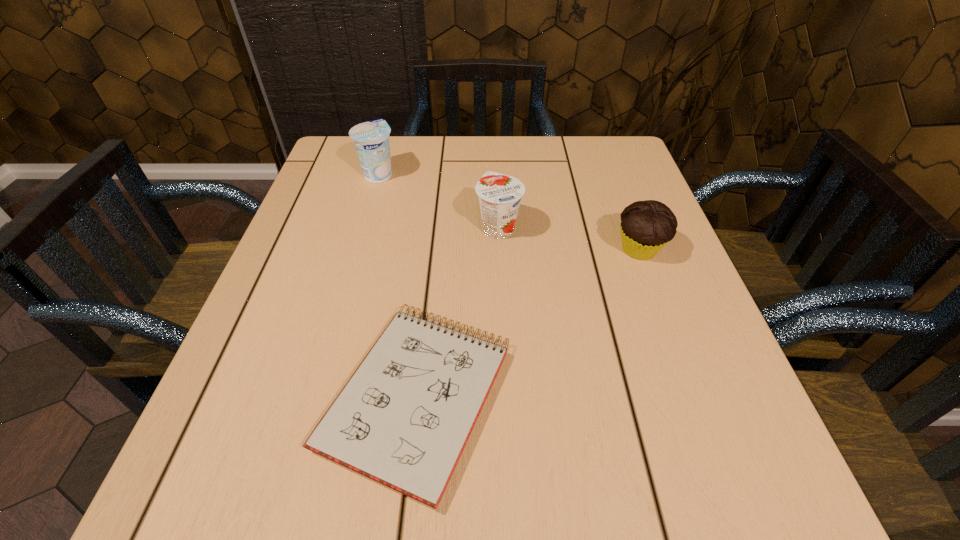
You are a GUI agent. You are given a task and a screenshot of the screen. Output one action in this format:
    pyautogui.click(x=<x>, y=<y>)
    Task: Click on the free space at the near left corner of the desktop
    This screenshot has width=960, height=540.
    Given the screenshot: What is the action you would take?
    pyautogui.click(x=194, y=507)

Find the location of a particular element. vacant space at the far right corner of the desktop is located at coordinates (625, 153).

This screenshot has height=540, width=960. I want to click on free space at the near right corner, so click(x=666, y=462).

At what (x,y) coordinates should I click in order to perform the action: click on free space that is in between the notepad and the nearer yogurt. Please return your answer as a coordinate pair (x, y). Looking at the image, I should click on (458, 312).

The height and width of the screenshot is (540, 960). Find the location of `vacant area that lies between the farthest object and the nearest object`. vacant area that lies between the farthest object and the nearest object is located at coordinates (397, 285).

What are the coordinates of `free space that is in between the right yogurt and the muffin` in the screenshot? It's located at (569, 239).

This screenshot has width=960, height=540. Identify the location of unoccupied area between the notepad and the muffin. (528, 323).

Where is `free point between the nearest object and the muffin`? The width and height of the screenshot is (960, 540). free point between the nearest object and the muffin is located at coordinates (528, 323).

Where is `free space between the nearest object and the farther yogurt`? The image size is (960, 540). free space between the nearest object and the farther yogurt is located at coordinates (397, 285).

Locate an element on the screen. free space between the rightmost object and the nearest object is located at coordinates click(528, 323).